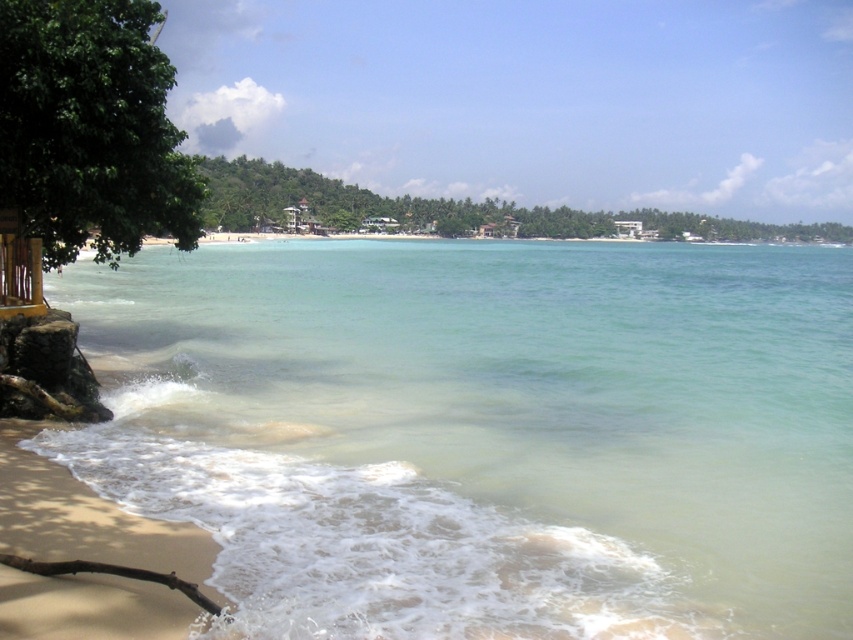
Question: Which point appears closest to the camera in this image?

Choices:
 (A) (729, 253)
 (B) (194, 168)
 (C) (126, 636)
 (D) (611, 220)

Answer: (C)

Question: Which point appears farthest from the camera in this image?

Choices:
 (A) (405, 221)
 (B) (352, 500)
 (C) (129, 132)
 (D) (115, 563)

Answer: (A)

Question: Does clear water at lower left have a larger size compared to green leafy tree at left?

Choices:
 (A) yes
 (B) no

Answer: (A)

Question: Can you confirm if light tan sand at lower left is positioned above green leafy tree at upper center?

Choices:
 (A) no
 (B) yes

Answer: (A)

Question: Which point is farther from the camera taking this photo?

Choices:
 (A) (582, 220)
 (B) (134, 16)
 (C) (148, 589)
 (D) (770, 518)

Answer: (A)

Question: Is clear water at lower left positioned in front of light tan sand at lower left?

Choices:
 (A) yes
 (B) no

Answer: (A)